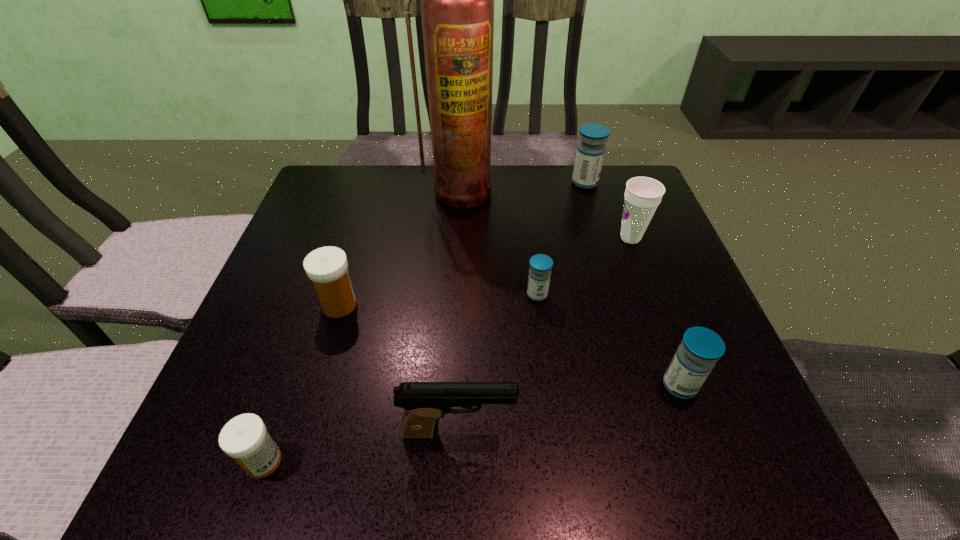
Identify the location of the second smallest blue medicine. The height and width of the screenshot is (540, 960). (700, 349).

The height and width of the screenshot is (540, 960). What are the coordinates of `the smallest blue medicine` in the screenshot? It's located at (541, 265).

At what (x,y) coordinates should I click in order to perform the action: click on the leftmost blue medicine. Please return your answer as a coordinate pair (x, y). Looking at the image, I should click on tap(541, 265).

This screenshot has width=960, height=540. Find the location of `the nearest medicine`. the nearest medicine is located at coordinates (245, 438).

Find the location of a particular element. Image resolution: width=960 pixels, height=540 pixels. the nearest object is located at coordinates (245, 438).

The image size is (960, 540). What are the coordinates of `vacant space located on the side of the fire extinguisher with the label` in the screenshot? It's located at (451, 306).

The image size is (960, 540). I want to click on vacant region located on the front of the farthest blue medicine, so click(610, 265).

Find the location of a particular element. Image resolution: width=960 pixels, height=540 pixels. free point located 0.370m on the left of the purple cup is located at coordinates (452, 238).

Identify the location of free location located at the barrel of the pistol. (612, 432).

Image resolution: width=960 pixels, height=540 pixels. Find the location of `free location located 0.220m on the back of the bigger white medicine`. free location located 0.220m on the back of the bigger white medicine is located at coordinates (364, 224).